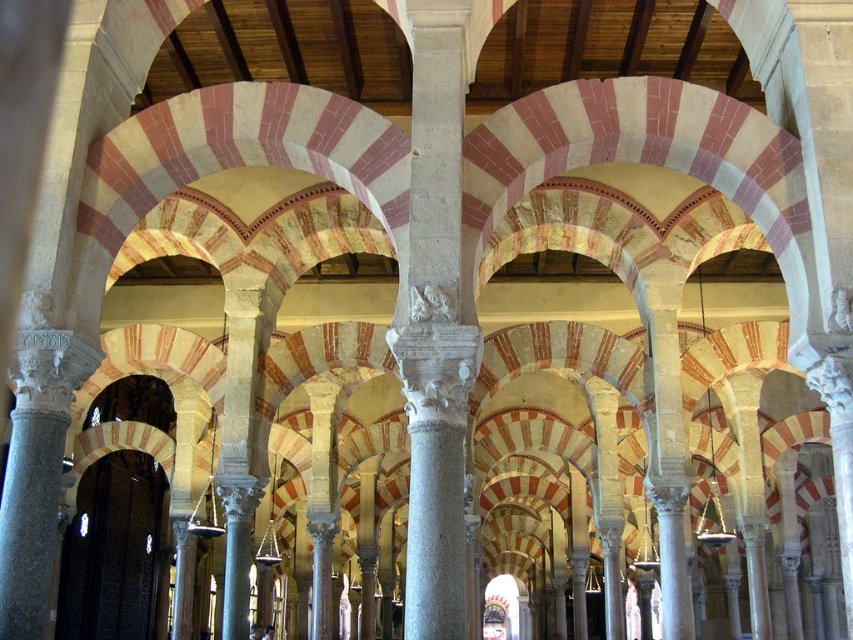
Does smooth stone column at center appear on the left side of gray stone column at center?

Incorrect, smooth stone column at center is not on the left side of gray stone column at center.

Which is behind, point (457, 586) or point (242, 595)?

Positioned behind is point (242, 595).

The width and height of the screenshot is (853, 640). In order to click on smooth stone column at center in this screenshot , I will do `click(434, 326)`.